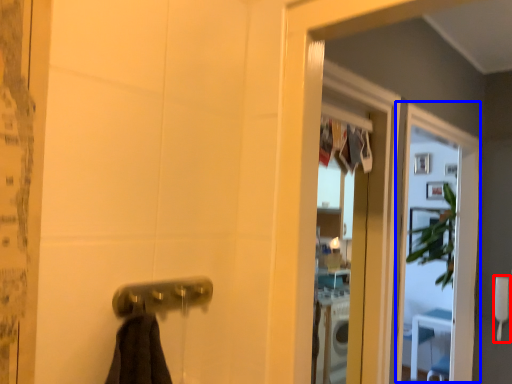
Question: Which of the following is the closest to the observer, towel bar (highlighted by a red box) or screen door (highlighted by a blue box)?

Choices:
 (A) towel bar
 (B) screen door

Answer: (B)